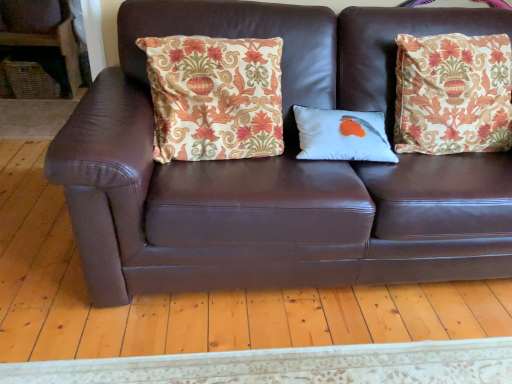
Question: Is brown leather couch at center at the back of patterned fabric pillow at center, the second pillow positioned from the right?

Choices:
 (A) no
 (B) yes

Answer: (B)

Question: Does patterned fabric pillow at center, the first pillow from the left, have a greater width compared to brown leather couch at center?

Choices:
 (A) yes
 (B) no

Answer: (B)

Question: Considering the relative sizes of patterned fabric pillow at center, the first pillow from the left, and brown leather couch at center in the image provided, is patterned fabric pillow at center, the first pillow from the left, taller than brown leather couch at center?

Choices:
 (A) yes
 (B) no

Answer: (B)

Question: Does patterned fabric pillow at center, the first pillow from the left, appear on the right side of brown leather couch at center?

Choices:
 (A) no
 (B) yes

Answer: (A)

Question: Can you confirm if patterned fabric pillow at center, the second pillow positioned from the right, is bigger than brown leather couch at center?

Choices:
 (A) yes
 (B) no

Answer: (B)

Question: From the image's perspective, is white matte pillow with bird design at center, acting as the first pillow starting from the right, located above or below woven wicker basket at left?

Choices:
 (A) above
 (B) below

Answer: (B)

Question: Is white matte pillow with bird design at center, acting as the first pillow starting from the right, situated inside woven wicker basket at left or outside?

Choices:
 (A) outside
 (B) inside

Answer: (A)

Question: Visually, is white matte pillow with bird design at center, which is counted as the second pillow, starting from the left, positioned to the left or to the right of woven wicker basket at left?

Choices:
 (A) left
 (B) right

Answer: (B)

Question: Is point (326, 144) positioned closer to the camera than point (11, 77)?

Choices:
 (A) farther
 (B) closer

Answer: (B)

Question: From a real-world perspective, relative to brown leather couch at center, is white matte pillow with bird design at center, which is counted as the second pillow, starting from the left, vertically above or below?

Choices:
 (A) above
 (B) below

Answer: (A)

Question: From their relative heights in the image, would you say white matte pillow with bird design at center, which is counted as the second pillow, starting from the left, is taller or shorter than brown leather couch at center?

Choices:
 (A) short
 (B) tall

Answer: (A)

Question: From the image's perspective, relative to brown leather couch at center, is white matte pillow with bird design at center, acting as the first pillow starting from the right, above or below?

Choices:
 (A) below
 (B) above

Answer: (B)

Question: In terms of size, does white matte pillow with bird design at center, which is counted as the second pillow, starting from the left, appear bigger or smaller than brown leather couch at center?

Choices:
 (A) big
 (B) small

Answer: (B)

Question: From the image's perspective, is brown leather couch at center located above or below woven wicker basket at left?

Choices:
 (A) above
 (B) below

Answer: (B)

Question: Considering their positions, is brown leather couch at center located in front of or behind woven wicker basket at left?

Choices:
 (A) front
 (B) behind

Answer: (A)